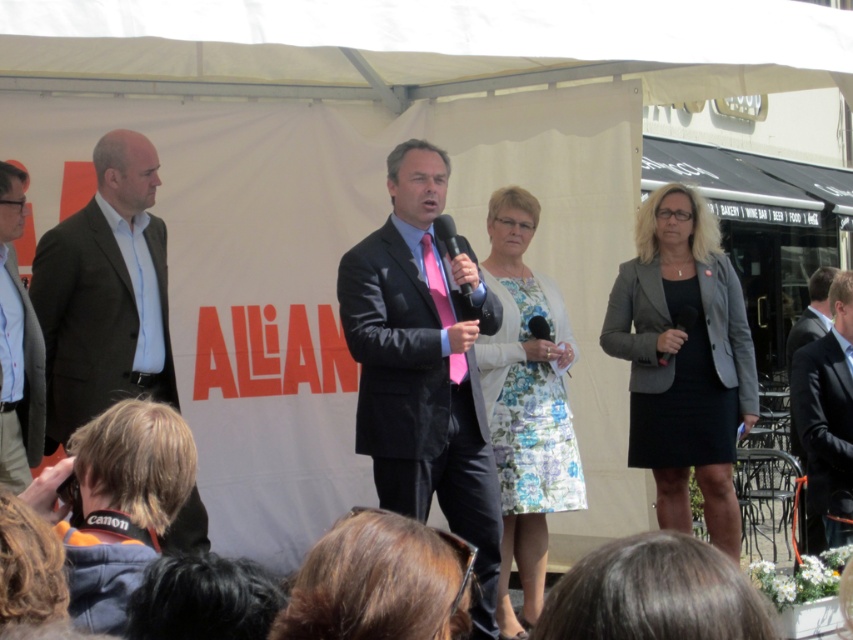
What do you see at coordinates (379, 582) in the screenshot?
I see `brown hair at center` at bounding box center [379, 582].

Is point (296, 605) positioned behind point (827, 387)?

No, it is not.

Between point (325, 618) and point (791, 410), which one is positioned in front?

Positioned in front is point (325, 618).

This screenshot has height=640, width=853. I want to click on brown hair at center, so click(x=379, y=582).

Can you confirm if dark brown suit at left is wider than shiny black microphone at center?

Yes.

Who is taller, dark brown suit at left or shiny black microphone at center?

With more height is dark brown suit at left.

Who is more forward, (140, 353) or (440, 221)?

Point (440, 221)

What are the coordinates of `dark brown suit at left` in the screenshot? It's located at (105, 292).

Based on the photo, does gray fabric blazer at right have a lesser height compared to black suit at right?

No.

Does gray fabric blazer at right appear on the right side of black suit at right?

No, gray fabric blazer at right is not to the right of black suit at right.

Is point (694, 406) farther from viewer compared to point (830, 289)?

No, (694, 406) is closer to viewer.

The image size is (853, 640). Find the location of `gray fabric blazer at right`. gray fabric blazer at right is located at coordinates (683, 360).